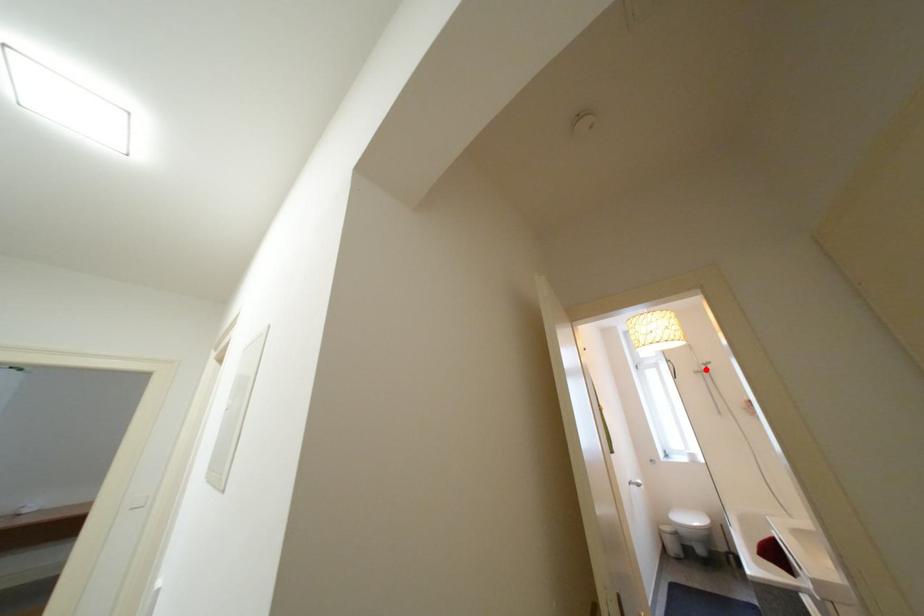
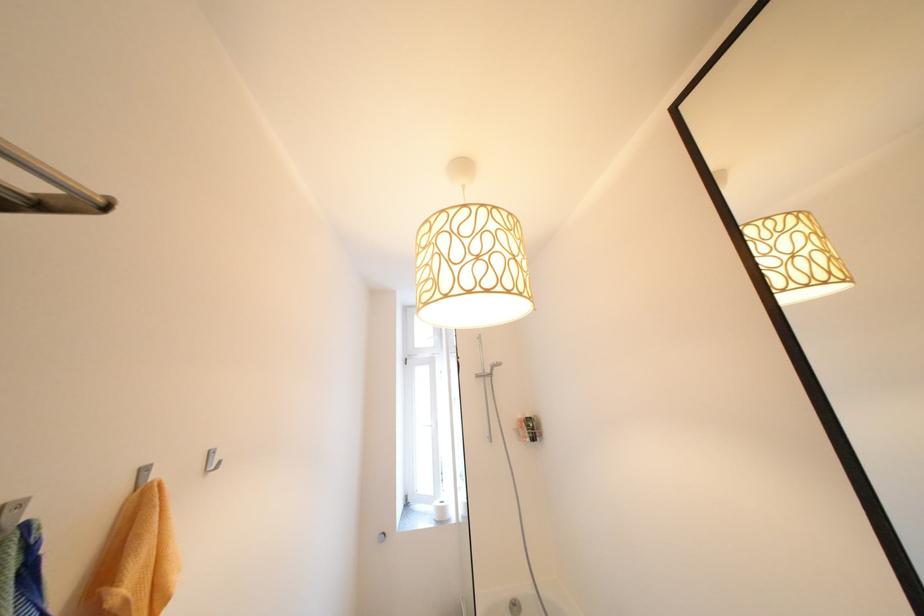
In the second image, find the point that corresponds to the highlighted location in the first image.

(490, 371)